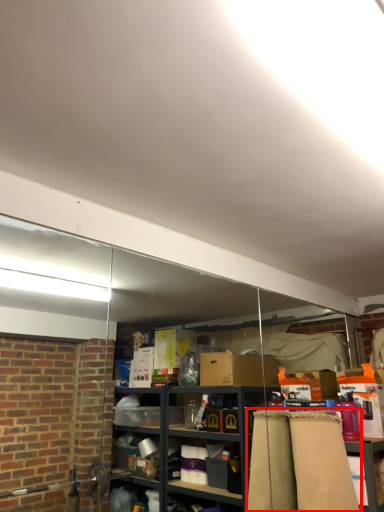
Question: Considering the relative positions of curtain (annotated by the red box) and table in the image provided, where is curtain (annotated by the red box) located with respect to the staircase?

Choices:
 (A) right
 (B) left

Answer: (B)